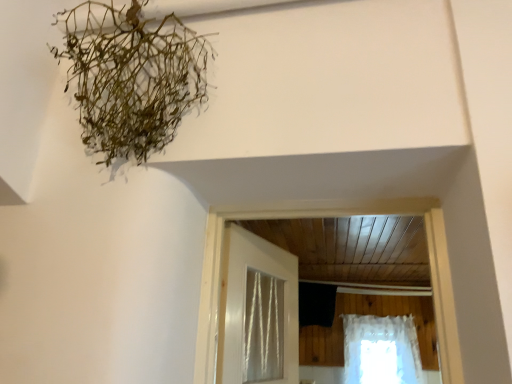
Question: Considering the relative sizes of green fibrous plant at upper left and white glossy door at center in the image provided, is green fibrous plant at upper left smaller than white glossy door at center?

Choices:
 (A) no
 (B) yes

Answer: (A)

Question: Is white glossy door at center surrounded by green fibrous plant at upper left?

Choices:
 (A) yes
 (B) no

Answer: (B)

Question: Is green fibrous plant at upper left positioned far away from white glossy door at center?

Choices:
 (A) yes
 (B) no

Answer: (B)

Question: Is green fibrous plant at upper left next to white glossy door at center and touching it?

Choices:
 (A) no
 (B) yes

Answer: (A)

Question: Can you confirm if green fibrous plant at upper left is positioned to the left of white glossy door at center?

Choices:
 (A) yes
 (B) no

Answer: (A)

Question: Can you confirm if green fibrous plant at upper left is thinner than white glossy door at center?

Choices:
 (A) yes
 (B) no

Answer: (B)

Question: Is white lace curtain at lower right facing towards white glossy door at center?

Choices:
 (A) yes
 (B) no

Answer: (A)

Question: Does white lace curtain at lower right have a lesser width compared to white glossy door at center?

Choices:
 (A) no
 (B) yes

Answer: (A)

Question: Is white lace curtain at lower right bigger than white glossy door at center?

Choices:
 (A) yes
 (B) no

Answer: (A)

Question: From a real-world perspective, does white lace curtain at lower right sit lower than white glossy door at center?

Choices:
 (A) yes
 (B) no

Answer: (A)

Question: Considering the relative sizes of white lace curtain at lower right and white glossy door at center in the image provided, is white lace curtain at lower right shorter than white glossy door at center?

Choices:
 (A) yes
 (B) no

Answer: (B)

Question: From a real-world perspective, is white lace curtain at lower right positioned over white glossy door at center based on gravity?

Choices:
 (A) yes
 (B) no

Answer: (B)

Question: From the image's perspective, would you say green fibrous plant at upper left is shown under white lace curtain at lower right?

Choices:
 (A) no
 (B) yes

Answer: (A)